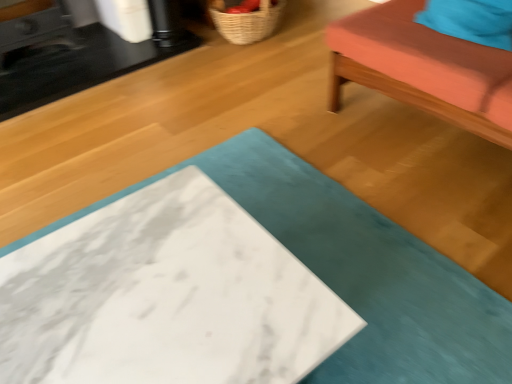
At what (x,y) coordinates should I click in order to perform the action: click on free space above white marble table at center, marked as the second table in a back-to-front arrangement (from a real-world perspective). Please return your answer as a coordinate pair (x, y). Looking at the image, I should click on (135, 286).